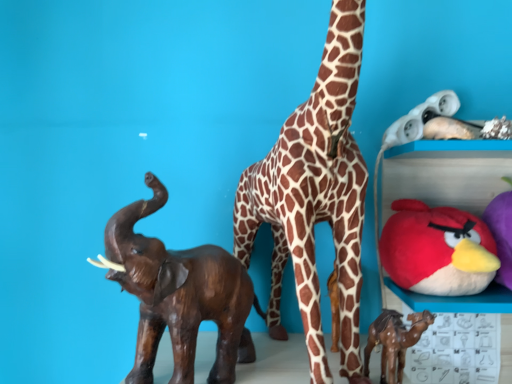
Question: From the image's perspective, is brown glossy camel at lower right, the 3th toy positioned from the right, located above red plush toy at upper right, the second toy when ordered from right to left?

Choices:
 (A) yes
 (B) no

Answer: (B)

Question: Would you consider brown glossy camel at lower right, the 3th toy positioned from the right, to be distant from red plush toy at upper right, marked as the 3th toy in a left-to-right arrangement?

Choices:
 (A) no
 (B) yes

Answer: (A)

Question: From the image's perspective, would you say brown glossy camel at lower right, the 3th toy positioned from the right, is shown under red plush toy at upper right, the second toy when ordered from right to left?

Choices:
 (A) no
 (B) yes

Answer: (B)

Question: Is brown glossy camel at lower right, which is the second toy in left-to-right order, next to red plush toy at upper right, the second toy when ordered from right to left, and touching it?

Choices:
 (A) no
 (B) yes

Answer: (A)

Question: Is brown glossy camel at lower right, the 3th toy positioned from the right, thinner than red plush toy at upper right, marked as the 3th toy in a left-to-right arrangement?

Choices:
 (A) yes
 (B) no

Answer: (A)

Question: Does brown glossy camel at lower right, which is the second toy in left-to-right order, have a greater width compared to red plush toy at upper right, marked as the 3th toy in a left-to-right arrangement?

Choices:
 (A) no
 (B) yes

Answer: (A)

Question: Can you confirm if brown spotted fabric giraffe at center is shorter than brown wooden elephant at left, acting as the fourth toy starting from the right?

Choices:
 (A) yes
 (B) no

Answer: (B)

Question: Is brown spotted fabric giraffe at center positioned with its back to brown wooden elephant at left, placed as the first toy when sorted from left to right?

Choices:
 (A) no
 (B) yes

Answer: (A)

Question: From a real-world perspective, is brown spotted fabric giraffe at center physically above brown wooden elephant at left, acting as the fourth toy starting from the right?

Choices:
 (A) yes
 (B) no

Answer: (A)

Question: Can you confirm if brown spotted fabric giraffe at center is wider than brown wooden elephant at left, acting as the fourth toy starting from the right?

Choices:
 (A) no
 (B) yes

Answer: (B)

Question: Considering the relative sizes of brown spotted fabric giraffe at center and brown wooden elephant at left, acting as the fourth toy starting from the right, in the image provided, is brown spotted fabric giraffe at center bigger than brown wooden elephant at left, acting as the fourth toy starting from the right,?

Choices:
 (A) no
 (B) yes

Answer: (B)

Question: Is brown spotted fabric giraffe at center positioned in front of brown wooden elephant at left, placed as the first toy when sorted from left to right?

Choices:
 (A) yes
 (B) no

Answer: (A)

Question: From the image's perspective, would you say brown spotted fabric giraffe at center is shown under red plush toy at upper right, the second toy when ordered from right to left?

Choices:
 (A) no
 (B) yes

Answer: (A)